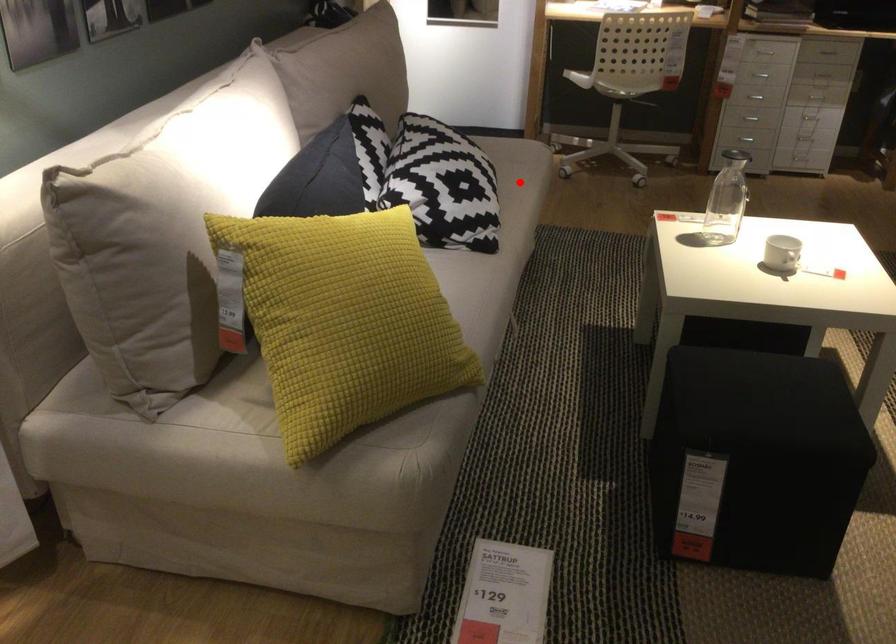
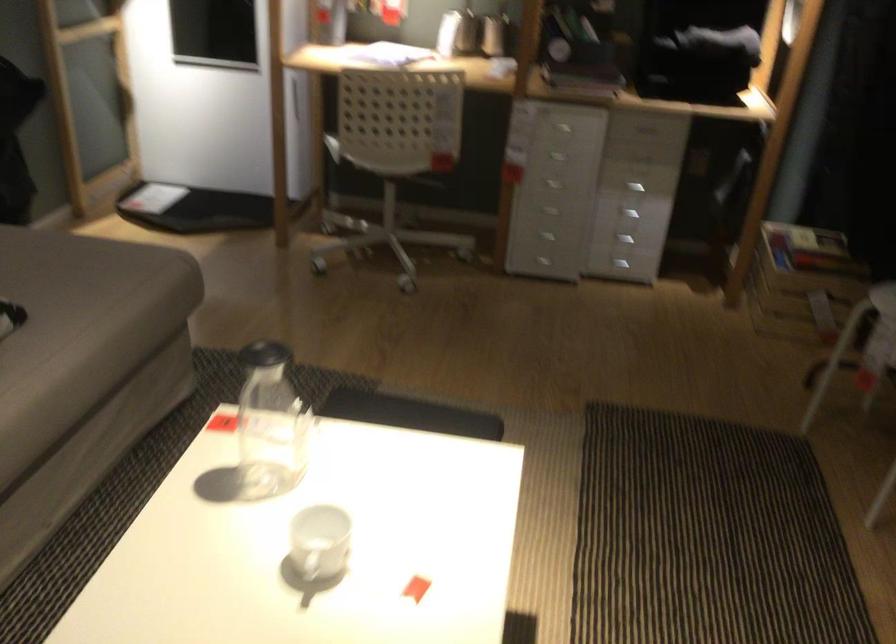
Locate, in the second image, the point that corresponds to the highlighted location in the first image.

(82, 324)